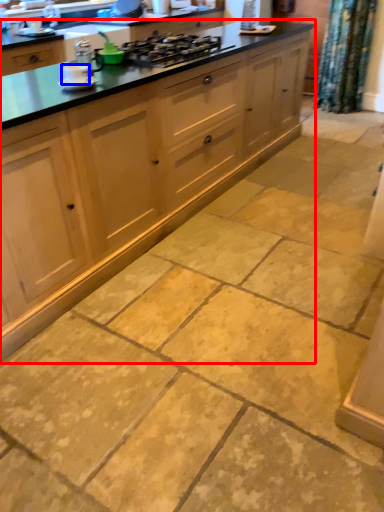
Question: Which point is further to the camera, cabinetry (highlighted by a red box) or appliance (highlighted by a blue box)?

Choices:
 (A) cabinetry
 (B) appliance

Answer: (B)